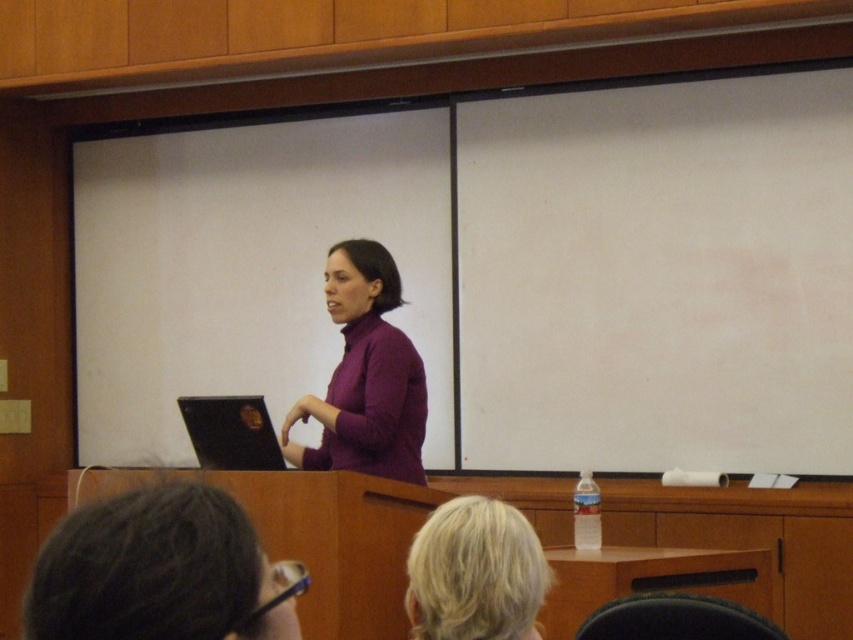
You are an attendee in the classroom. You want to take a photo of the purple matte sweater at center. Where should you aim your camera to capture it?

You should aim your camera at point (364, 376) to capture the purple matte sweater at center.

You are sitting in the front row of the classroom and want to see both the purple matte sweater at center and the blonde hair at upper center. Which one will appear closer to you?

The purple matte sweater at center appears closer to you because it is further to the viewer than the blonde hair at upper center.